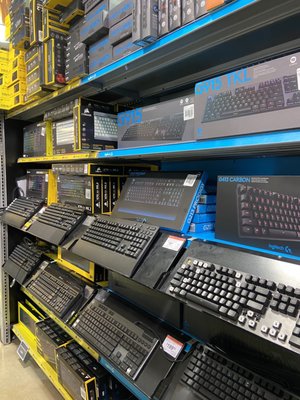
This screenshot has width=300, height=400. In order to click on dark gray keyboard in this screenshot , I will do `click(187, 395)`.